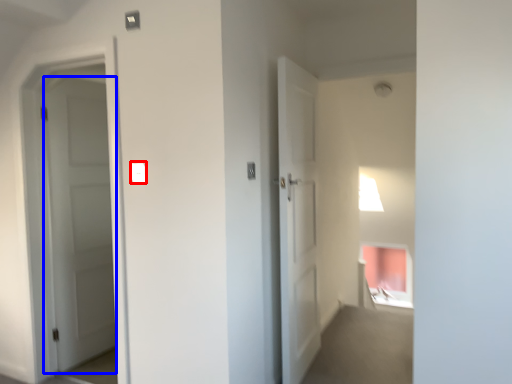
Question: Which point is closer to the camera, light switch (highlighted by a red box) or door (highlighted by a blue box)?

Choices:
 (A) light switch
 (B) door

Answer: (A)